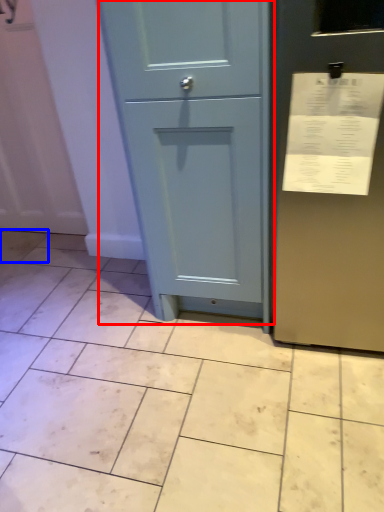
Question: Which point is further to the camera, door (highlighted by a red box) or ceramic tile (highlighted by a blue box)?

Choices:
 (A) door
 (B) ceramic tile

Answer: (B)